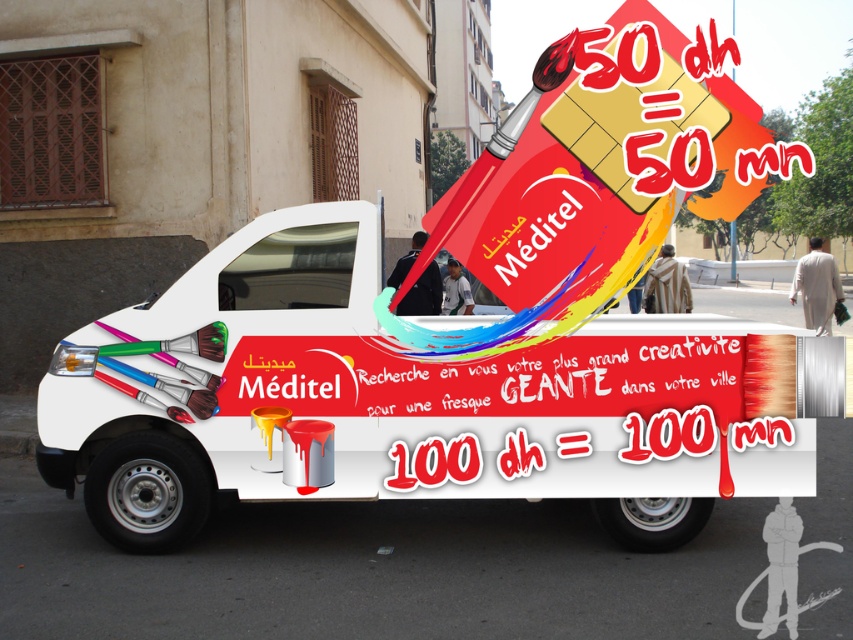
Question: Is white matte truck at center to the left of metallic paint can at center from the viewer's perspective?

Choices:
 (A) no
 (B) yes

Answer: (B)

Question: Is white matte truck at center wider than metallic paint can at center?

Choices:
 (A) yes
 (B) no

Answer: (A)

Question: Is white matte truck at center to the right of metallic paint can at center from the viewer's perspective?

Choices:
 (A) no
 (B) yes

Answer: (A)